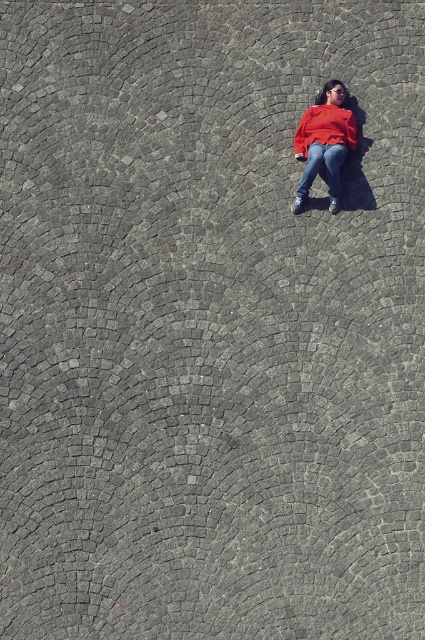
Question: Which object is farther from the camera taking this photo?

Choices:
 (A) matte red sweatshirt at center
 (B) jeans at center
 (C) matte red sweater at center

Answer: (A)

Question: Does matte red sweatshirt at center have a lesser width compared to jeans at center?

Choices:
 (A) no
 (B) yes

Answer: (A)

Question: Which object appears closest to the camera in this image?

Choices:
 (A) jeans at center
 (B) matte red sweatshirt at center

Answer: (A)

Question: Is matte red sweater at center above jeans at center?

Choices:
 (A) no
 (B) yes

Answer: (B)

Question: Which point is closer to the camera?

Choices:
 (A) jeans at center
 (B) matte red sweatshirt at center

Answer: (A)

Question: Does matte red sweatshirt at center appear under jeans at center?

Choices:
 (A) no
 (B) yes

Answer: (A)